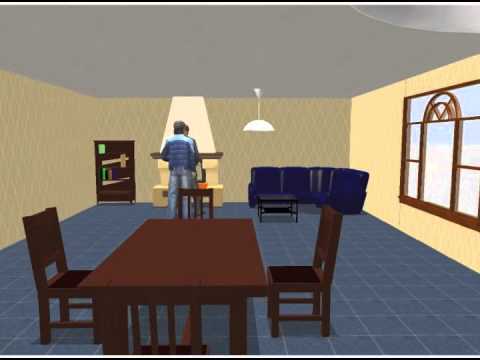
At what (x,y) coordinates should I click in order to perform the action: click on window. Please return your answer as a coordinate pair (x, y). The height and width of the screenshot is (360, 480). Looking at the image, I should click on (431, 167).